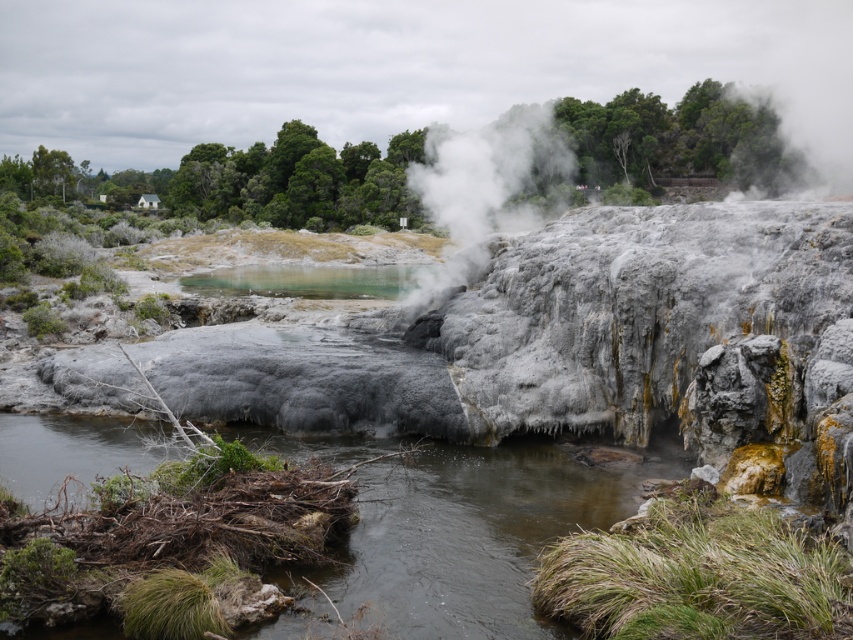
Question: Is brown wood at center above white fluffy steam at upper center?

Choices:
 (A) no
 (B) yes

Answer: (A)

Question: Is brown wood at center further to the viewer compared to white fluffy steam at upper center?

Choices:
 (A) yes
 (B) no

Answer: (B)

Question: Does brown wood at center lie behind white fluffy steam at upper center?

Choices:
 (A) yes
 (B) no

Answer: (B)